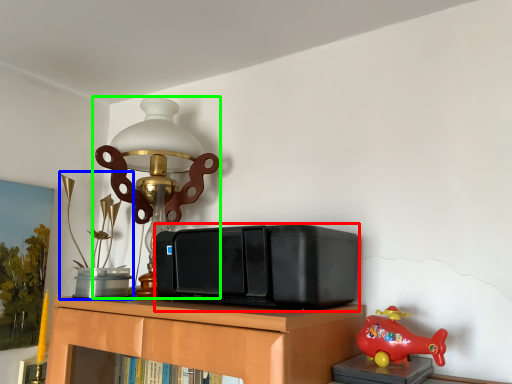
Question: Considering the real-world distances, which object is farthest from stereo (highlighted by a red box)? toy (highlighted by a blue box) or lamp (highlighted by a green box)?

Choices:
 (A) toy
 (B) lamp

Answer: (A)